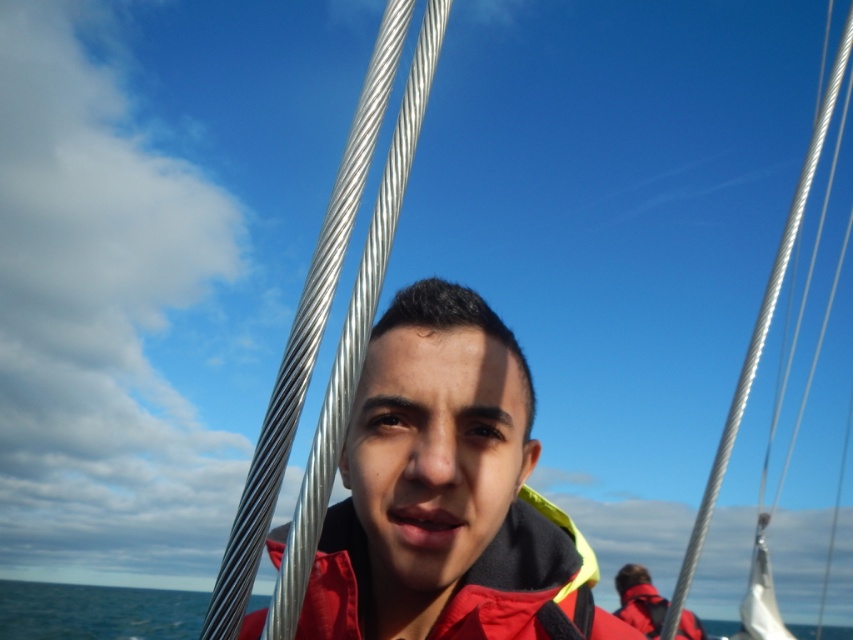
Does silver/metallic mast at center come behind blue water at lower left?

No.

Is silver/metallic mast at center above blue water at lower left?

Yes, silver/metallic mast at center is above blue water at lower left.

Is point (392, 212) behind point (190, 630)?

No, it is not.

Locate an element on the screen. silver/metallic mast at center is located at coordinates (303, 337).

Can you confirm if red matte jacket at center is positioned to the left of blue water at lower left?

Incorrect, red matte jacket at center is not on the left side of blue water at lower left.

Is point (459, 620) more distant than point (15, 604)?

No.

Who is more distant from viewer, (281, 538) or (158, 616)?

The point (158, 616) is behind.

You are a GUI agent. You are given a task and a screenshot of the screen. Output one action in this format:
    pyautogui.click(x=<x>, y=<y>)
    Task: Click on the red matte jacket at center
    
    Given the screenshot: What is the action you would take?
    pyautogui.click(x=531, y=582)

From the picture: Between matte red jacket at center and silver/metallic mast at center, which one appears on the right side from the viewer's perspective?

matte red jacket at center

Can you confirm if matte red jacket at center is wider than silver/metallic mast at center?

Yes.

Does point (344, 561) come in front of point (299, 392)?

No, it is behind (299, 392).

You are a GUI agent. You are given a task and a screenshot of the screen. Output one action in this format:
    pyautogui.click(x=<x>, y=<y>)
    Task: Click on the matte red jacket at center
    This screenshot has height=640, width=853.
    Given the screenshot: What is the action you would take?
    pyautogui.click(x=445, y=493)